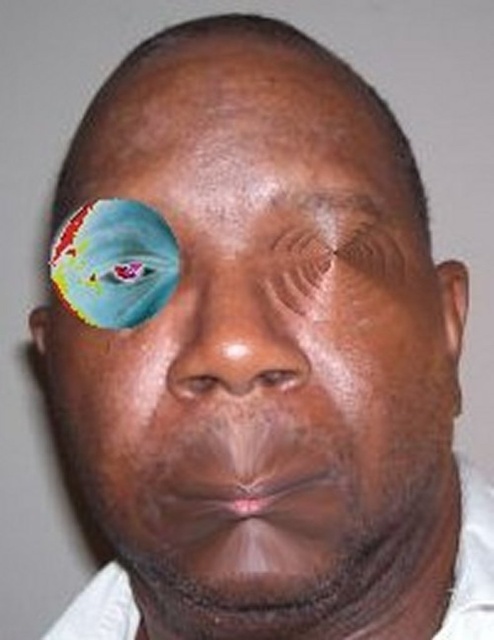
Which is below, matte blue eye at center or matte skin at center?

matte blue eye at center

Can you confirm if matte blue eye at center is bigger than matte skin at center?

Incorrect, matte blue eye at center is not larger than matte skin at center.

Is point (303, 268) behind point (370, 225)?

No, it is in front of (370, 225).

Find the location of a particular element. This screenshot has width=494, height=640. matte blue eye at center is located at coordinates (296, 266).

Is smooth skin nose at center smaller than matte blue eye at center?

No.

Measure the distance from smooth skin nose at center to matte blue eye at center.

smooth skin nose at center and matte blue eye at center are 0.75 inches apart.

Is point (235, 275) positioned before point (282, 259)?

Yes.

Locate an element on the screen. Image resolution: width=494 pixels, height=640 pixels. smooth skin nose at center is located at coordinates (231, 339).

Is white cotton dress shirt at lower right positioned behind matte skin at center?

Yes, white cotton dress shirt at lower right is further from the viewer.

Is white cotton dress shirt at lower right to the right of matte skin at center from the viewer's perspective?

No, white cotton dress shirt at lower right is not to the right of matte skin at center.

Which is in front, point (129, 595) or point (368, 214)?

Positioned in front is point (368, 214).

This screenshot has height=640, width=494. I want to click on white cotton dress shirt at lower right, so [x=472, y=563].